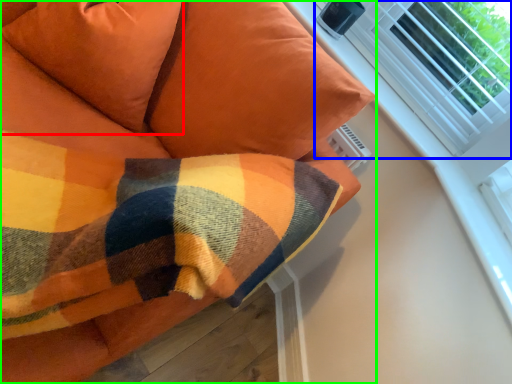
Question: Estimate the real-world distances between objects in this image. Which object is closer to pillow (highlighted by a red box), bay window (highlighted by a blue box) or furniture (highlighted by a green box)?

Choices:
 (A) bay window
 (B) furniture

Answer: (B)